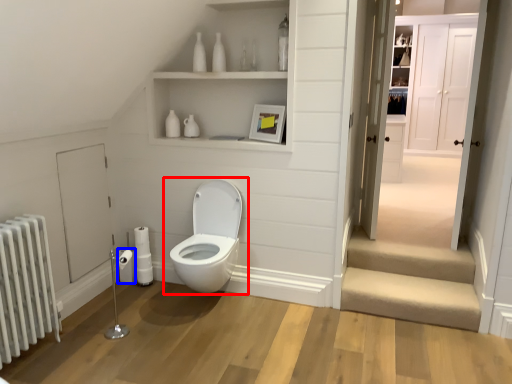
Question: Which object appears farthest to the camera in this image, toilet (highlighted by a red box) or toilet paper (highlighted by a blue box)?

Choices:
 (A) toilet
 (B) toilet paper

Answer: (B)